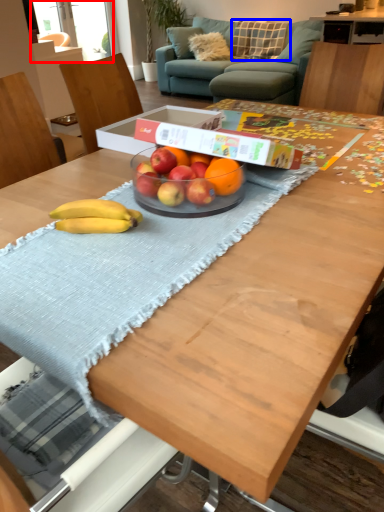
Question: Which object appears closest to the camera in this image, window screen (highlighted by a red box) or pillow (highlighted by a blue box)?

Choices:
 (A) window screen
 (B) pillow

Answer: (B)